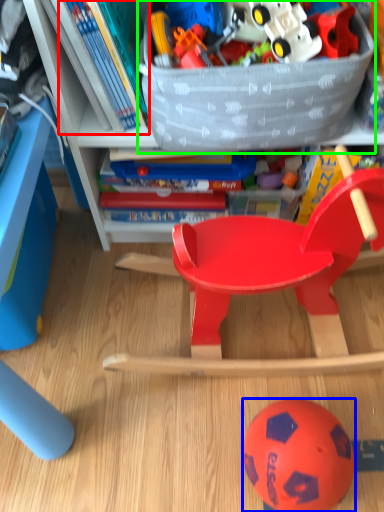
Question: Which object is positioned closest to book (highlighted by a red box)? Select from ball (highlighted by a blue box) and storage box (highlighted by a green box).

Choices:
 (A) ball
 (B) storage box

Answer: (B)